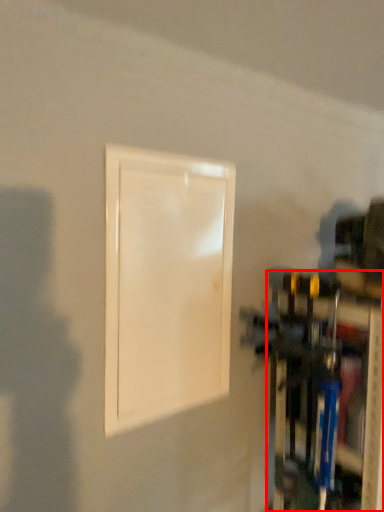
Question: Observing the image, what is the correct spatial positioning of shelf (annotated by the red box) in reference to door?

Choices:
 (A) left
 (B) right

Answer: (B)